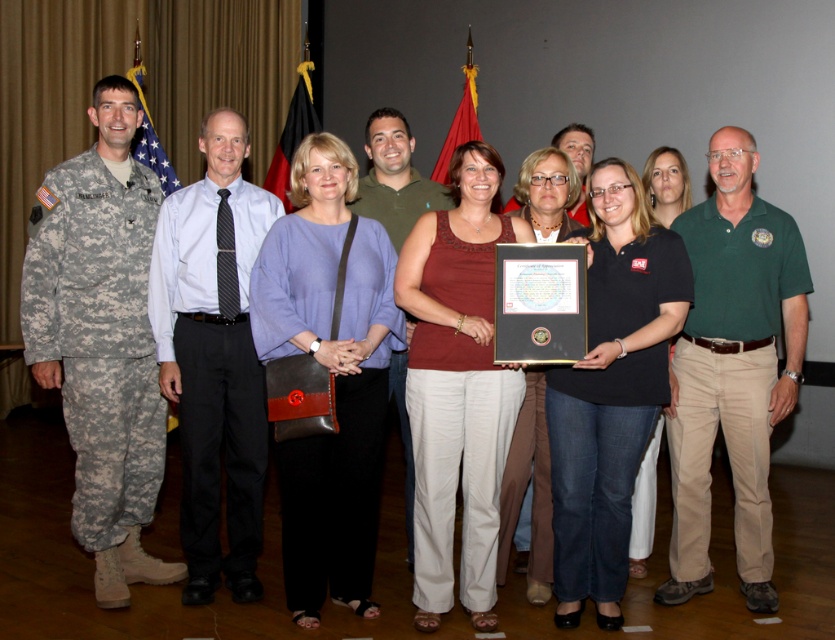
Is camouflage uniform at left to the right of black shirt at center from the viewer's perspective?

In fact, camouflage uniform at left is to the left of black shirt at center.

Which is more to the left, camouflage uniform at left or black shirt at center?

Positioned to the left is camouflage uniform at left.

Between point (79, 435) and point (631, 561), which one is positioned behind?

The point (631, 561) is more distant.

Locate an element on the screen. camouflage uniform at left is located at coordinates (100, 339).

Does camouflage uniform at left have a lesser width compared to green cotton shirt at center?

Incorrect, camouflage uniform at left's width is not less than green cotton shirt at center's.

Does camouflage uniform at left have a larger size compared to green cotton shirt at center?

Yes.

Locate an element on the screen. camouflage uniform at left is located at coordinates (100, 339).

Image resolution: width=835 pixels, height=640 pixels. What do you see at coordinates (100, 339) in the screenshot? I see `camouflage uniform at left` at bounding box center [100, 339].

The image size is (835, 640). Identify the location of camouflage uniform at left. (100, 339).

Is point (115, 572) farther from camera compared to point (317, 454)?

Yes, point (115, 572) is farther from viewer.

At what (x,y) coordinates should I click in order to perform the action: click on camouflage uniform at left. Please return your answer as a coordinate pair (x, y). Image resolution: width=835 pixels, height=640 pixels. Looking at the image, I should click on (100, 339).